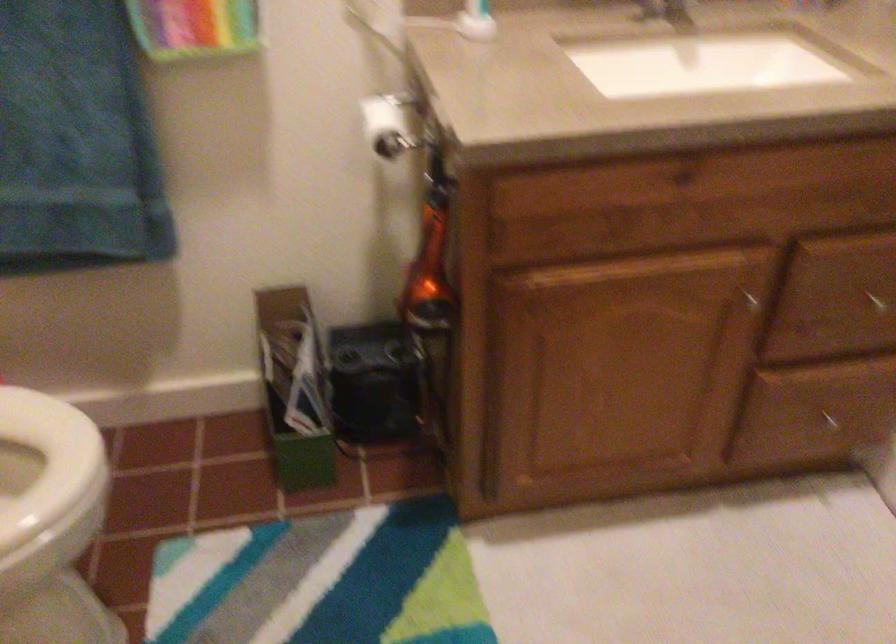
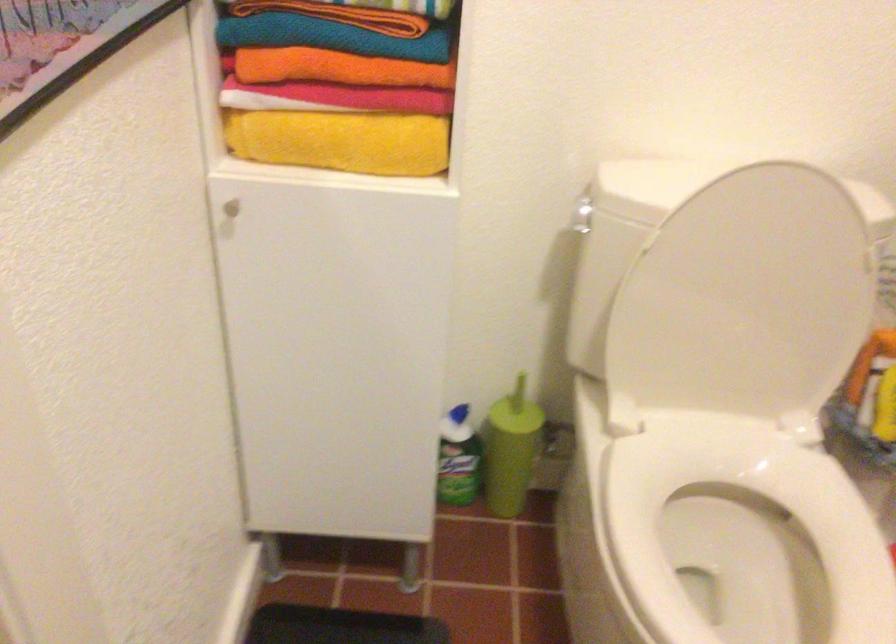
First-person continuous shooting, in which direction is the camera rotating?

The camera's rotation is toward left-down.